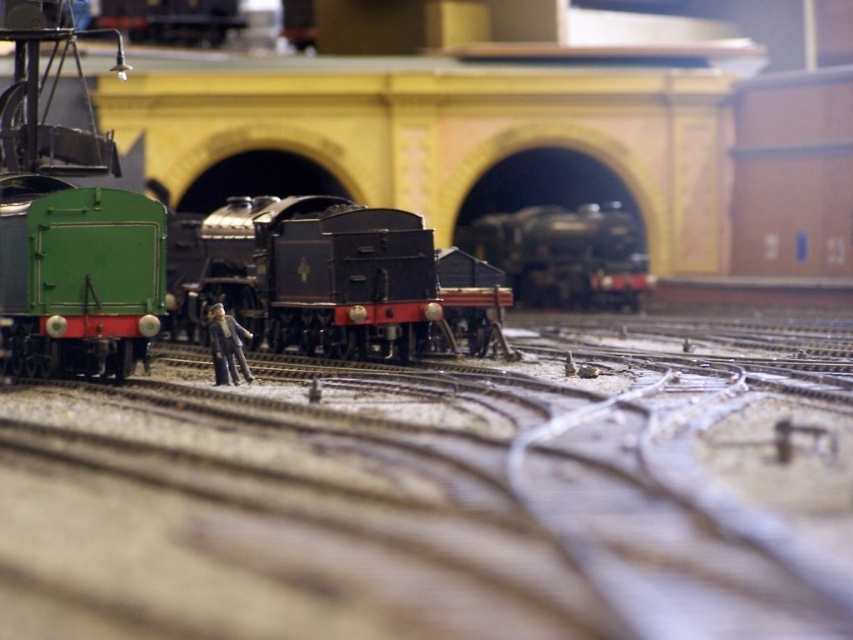
Is point (473, 432) positioned behind point (502, 262)?

No, it is not.

Can you confirm if brown gravel train track at center is bigger than shiny black locomotive at center?

Actually, brown gravel train track at center might be smaller than shiny black locomotive at center.

The image size is (853, 640). I want to click on brown gravel train track at center, so click(x=445, y=492).

Between point (543, 484) and point (213, 307), which one is positioned behind?

Point (213, 307)

Is brown gravel train track at center closer to the viewer compared to smooth gray figure at center?

Yes.

Is point (599, 445) positioned behind point (239, 328)?

No, it is in front of (239, 328).

Find the location of a particular element. The height and width of the screenshot is (640, 853). brown gravel train track at center is located at coordinates (445, 492).

Does shiny black locomotive at center appear over smooth gray figure at center?

Yes.

Is point (621, 280) positioned after point (228, 376)?

Yes, it is behind point (228, 376).

Locate an element on the screen. The height and width of the screenshot is (640, 853). shiny black locomotive at center is located at coordinates 563,253.